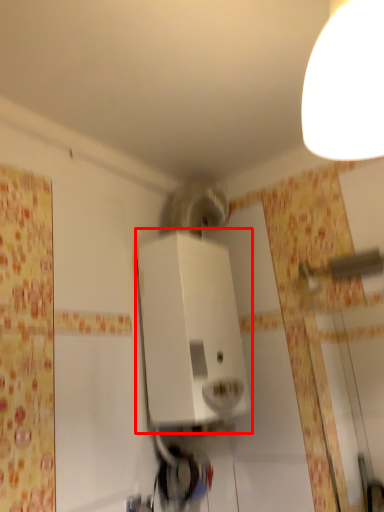
Question: In this image, where is appliance (annotated by the red box) located relative to light fixture?

Choices:
 (A) left
 (B) right

Answer: (A)